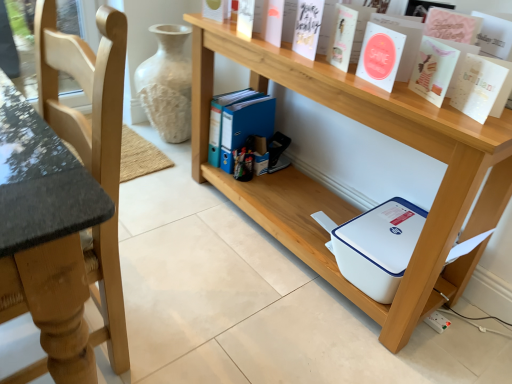
Find the location of a particular element. The height and width of the screenshot is (384, 512). vacant region in front of white plastic printer at lower center is located at coordinates (284, 324).